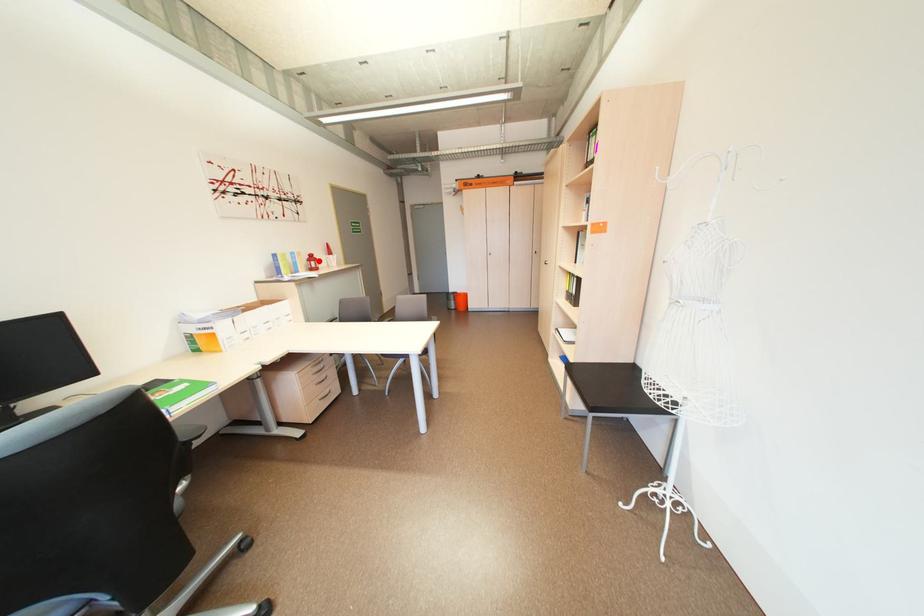
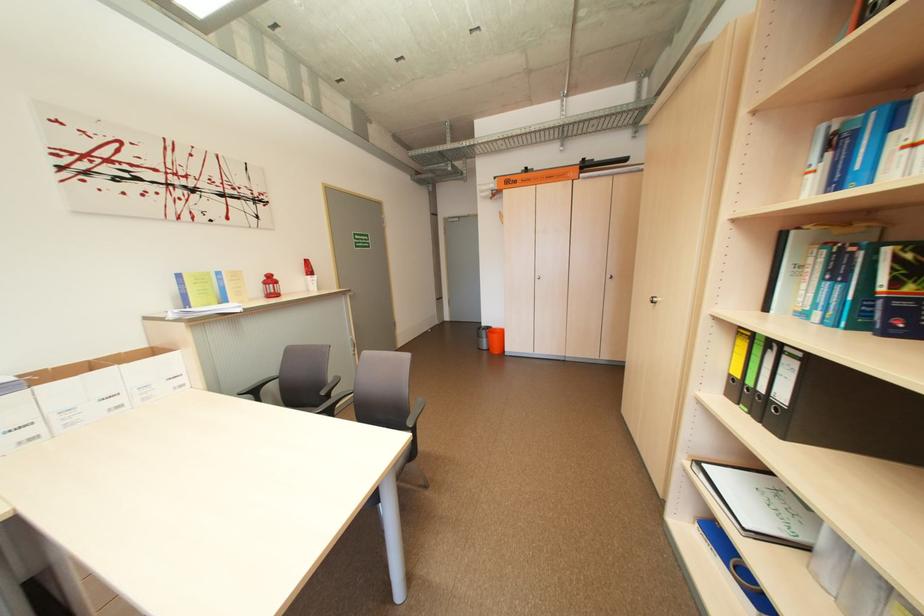
In the second image, find the point that corresponds to the highlighted location in the first image.

(274, 284)